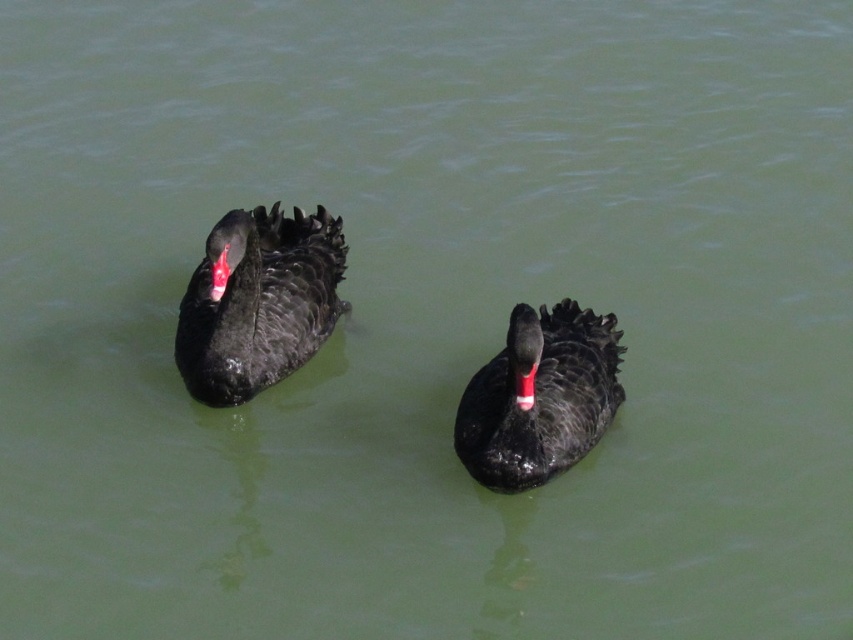
Between point (242, 372) and point (463, 465), which one is positioned behind?

Point (242, 372)

What are the coordinates of `matte black swan at left` in the screenshot? It's located at (258, 301).